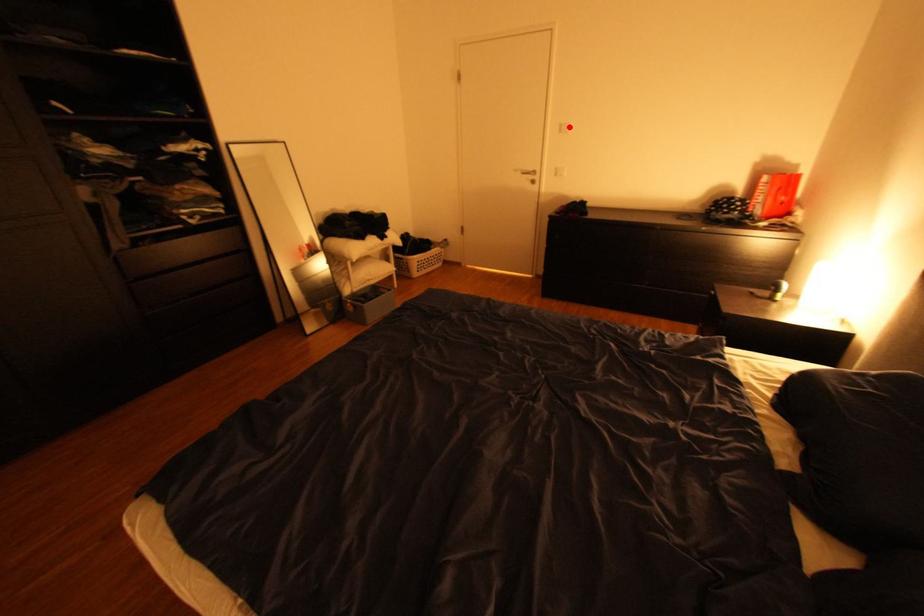
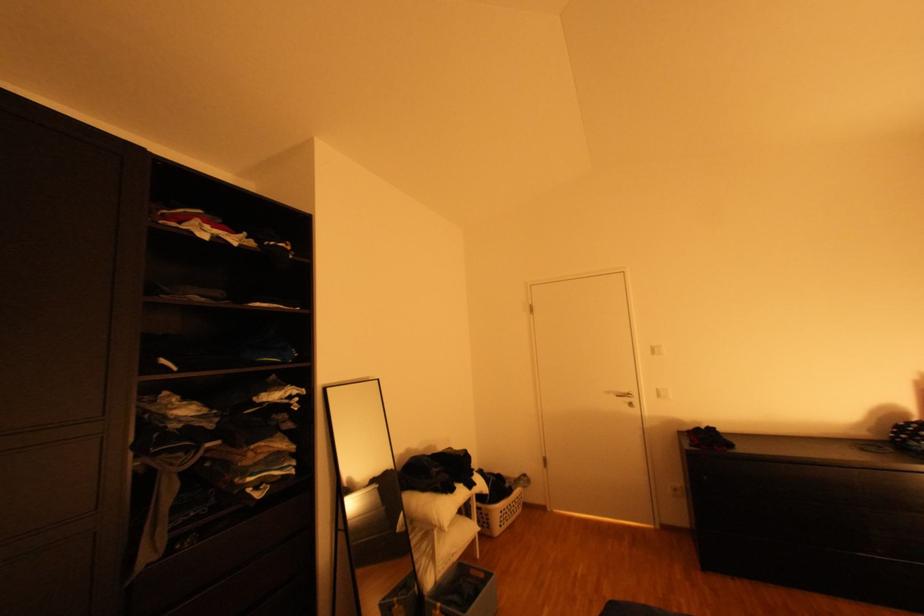
Find the pixel in the second image that matches the highlighted location in the first image.

(662, 349)